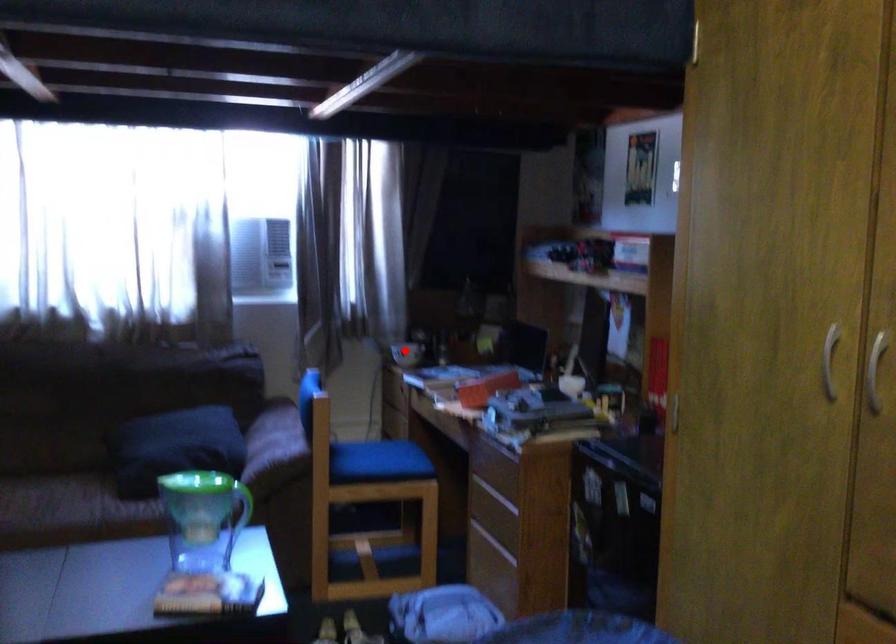
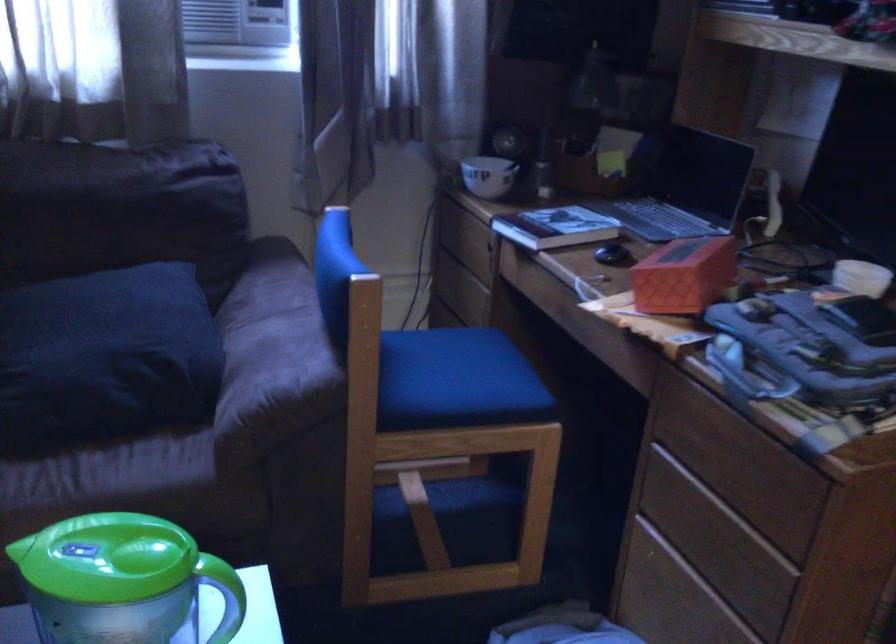
In the second image, find the point that corresponds to the highlighted location in the first image.

(487, 176)